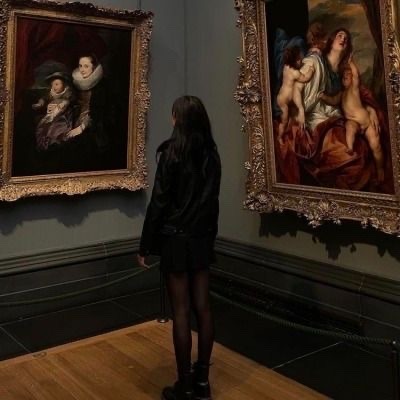
Identify the location of dark grey runners on wall. The image size is (400, 400). (278, 304), (71, 276).